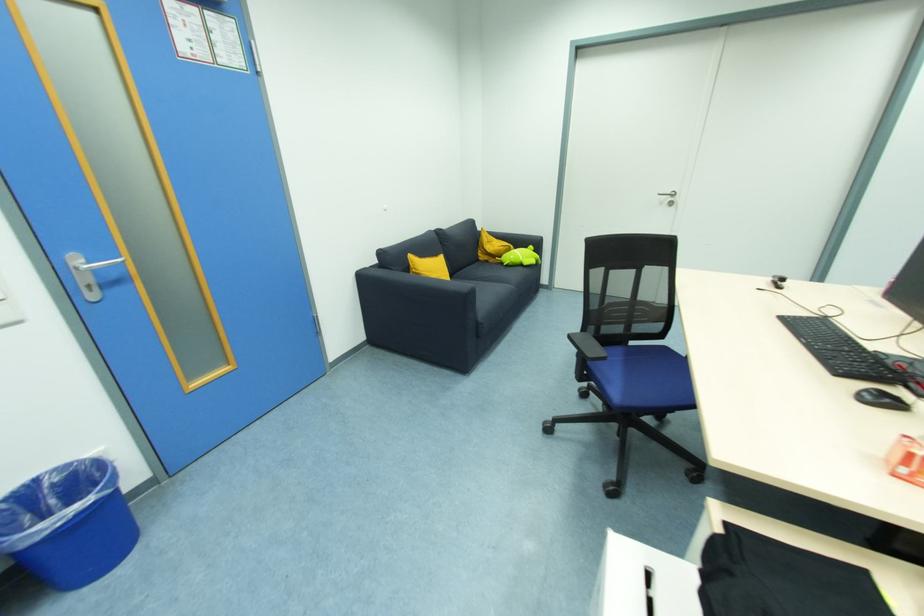
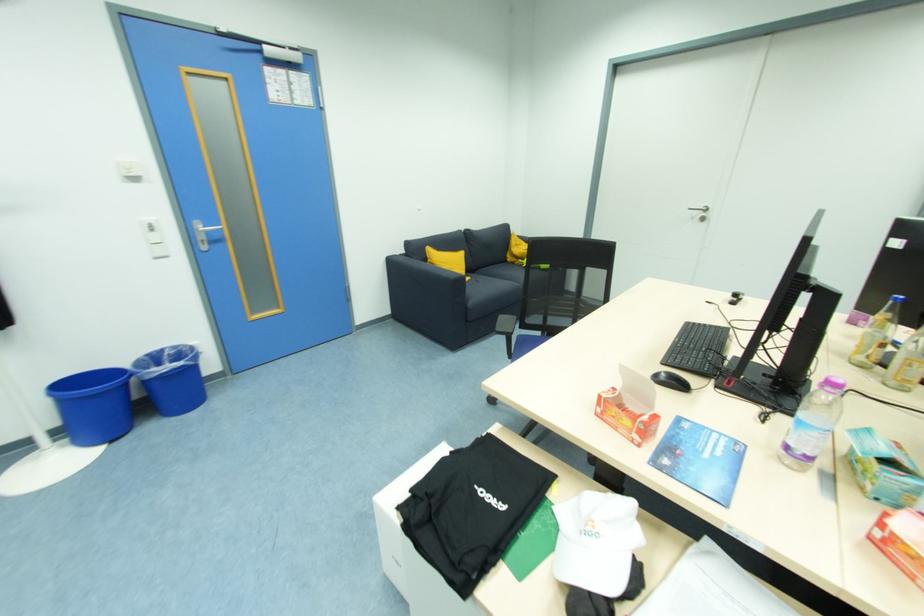
In the second image, find the point that corresponds to the point at 366,280 in the first image.

(395, 265)